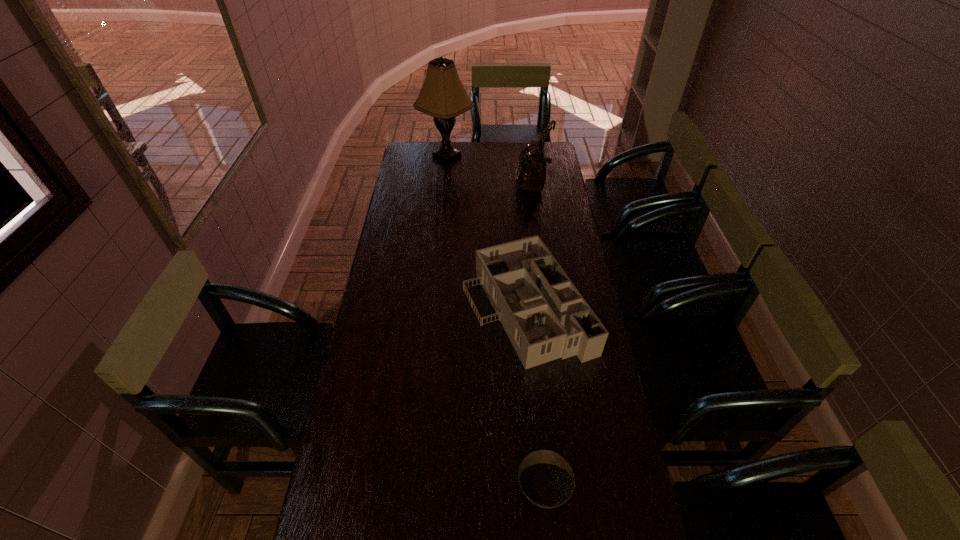
Where is `free space located on the front-facing side of the second farthest object`? free space located on the front-facing side of the second farthest object is located at coordinates (457, 190).

Locate an element on the screen. This screenshot has height=540, width=960. vacant space located on the front-facing side of the second farthest object is located at coordinates (496, 190).

Image resolution: width=960 pixels, height=540 pixels. Find the location of `free space located on the left of the second shortest object`. free space located on the left of the second shortest object is located at coordinates pos(368,308).

This screenshot has height=540, width=960. Find the location of `vacant area situated on the left of the nearest object`. vacant area situated on the left of the nearest object is located at coordinates (475, 489).

Where is `object that is at the far edge`? This screenshot has height=540, width=960. object that is at the far edge is located at coordinates (442, 96).

Identify the location of object situated at the left edge. Image resolution: width=960 pixels, height=540 pixels. (442, 96).

Where is `shoulder bag positioned at the right edge`? Image resolution: width=960 pixels, height=540 pixels. shoulder bag positioned at the right edge is located at coordinates (531, 169).

Identify the location of dollhouse situated at the right edge. (545, 317).

The image size is (960, 540). Identify the location of object that is at the far left corner. (442, 96).

In the image, there is a desktop. What are the coordinates of `vacant area at the far edge` in the screenshot? It's located at (475, 160).